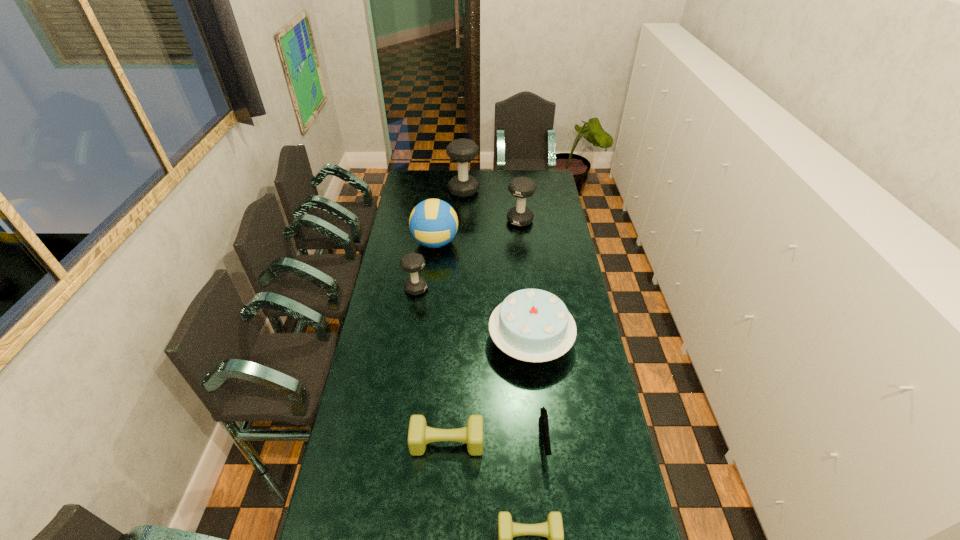
In order to click on vacant space that is in between the rightmost gray dumbbell and the farthest dumbbell in this screenshot , I will do `click(492, 206)`.

Identify the location of empty space that is in between the bigger olive dumbbell and the volleyball. (442, 342).

The image size is (960, 540). What are the coordinates of `empty space that is in between the leftmost gray dumbbell and the black pistol` in the screenshot? It's located at (480, 365).

Find the location of a particular element. Image resolution: width=960 pixels, height=540 pixels. vacant point located between the farther olive dumbbell and the black pistol is located at coordinates (495, 442).

Identify the location of free space between the blue volleyball and the black pistol. Image resolution: width=960 pixels, height=540 pixels. (490, 342).

This screenshot has height=540, width=960. What are the coordinates of `object that is the closest to the third farthest dumbbell` in the screenshot? It's located at (433, 223).

Point out which object is positioned as the sixth nearest to the right olive dumbbell. Please provide its 2D coordinates. Your answer should be formatted as a tuple, i.e. [(x, y)], where the tuple contains the x and y coordinates of a point satisfying the conditions above.

[(521, 187)]

Locate which dumbbell ranks fourth in proximity to the right olive dumbbell. Please provide its 2D coordinates. Your answer should be formatted as a tuple, i.e. [(x, y)], where the tuple contains the x and y coordinates of a point satisfying the conditions above.

[(462, 150)]

This screenshot has height=540, width=960. In order to click on dumbbell identified as the third closest to the farthest object in this screenshot , I will do click(x=419, y=434).

Identify which gray dumbbell is the second closest to the volleyball. Please provide its 2D coordinates. Your answer should be formatted as a tuple, i.e. [(x, y)], where the tuple contains the x and y coordinates of a point satisfying the conditions above.

[(521, 187)]